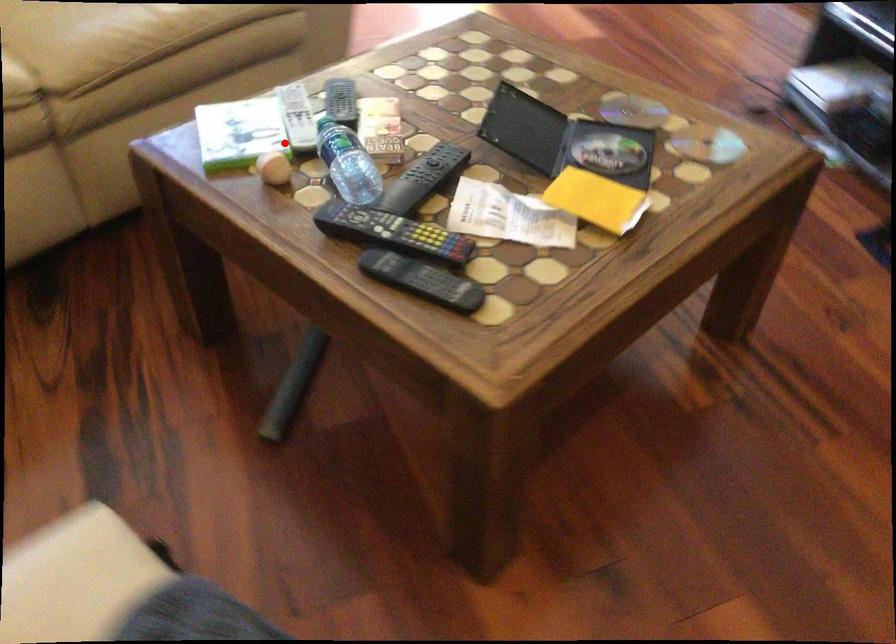
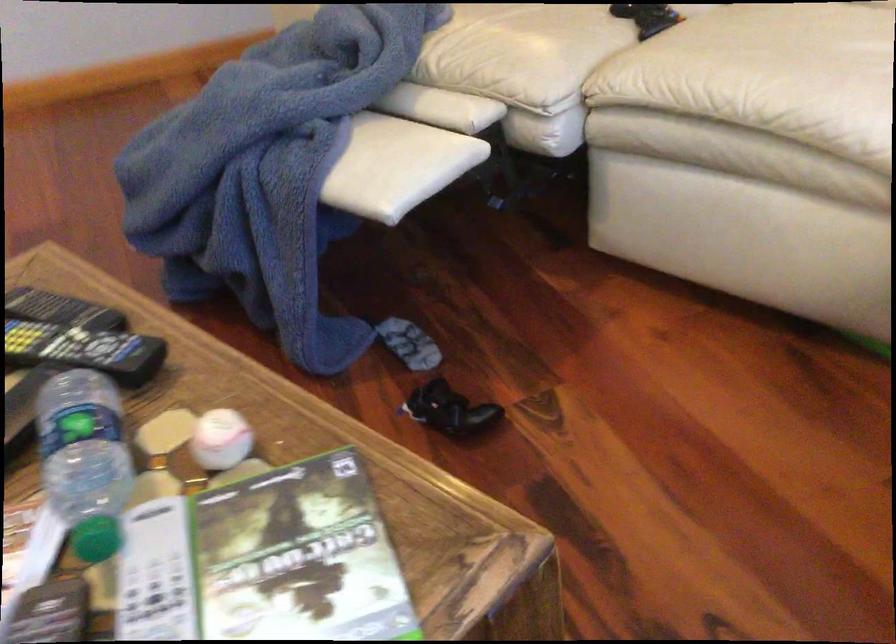
Locate, in the second image, the point that corresponds to the highlighted location in the first image.

(220, 439)